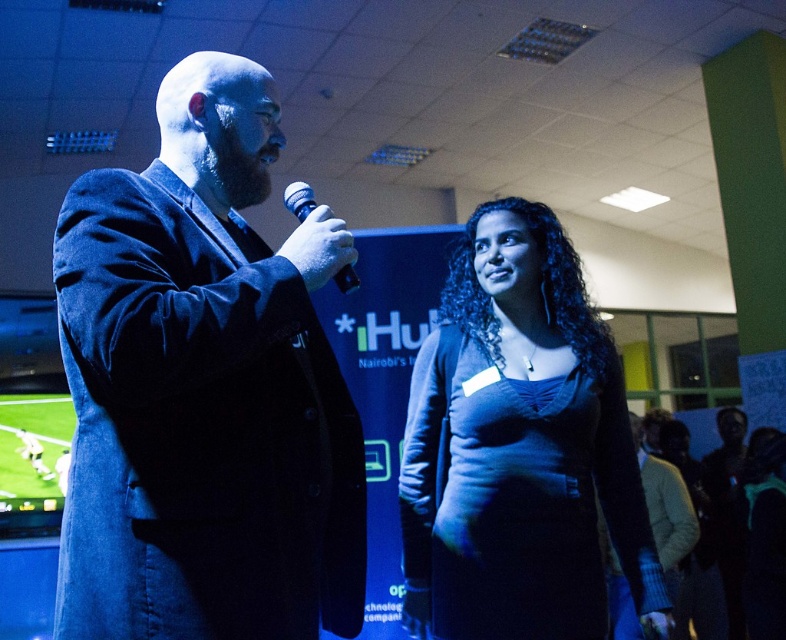
You are an event planner trying to arrange seating for two guests wearing the dark blue suit at left and the blue matte dress at center. The chairs available are only 18 inches wide. Can both guests sit comfortably without their clothing overlapping? Please explain based on the clothing descriptions provided.

The dark blue suit at left is thinner than the blue matte dress at center. Since the blue matte dress at center requires more space, it may not fit comfortably in an 18 inch wide chair. The dark blue suit at left might fit, but the blue matte dress at center might be too wide. Therefore, both guests may not be able to sit comfortably without overlapping.